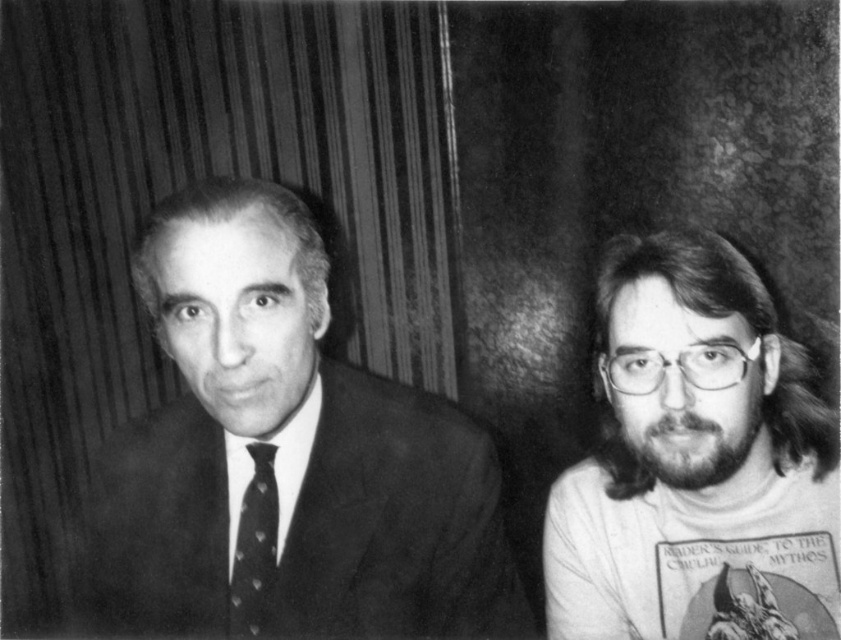
You are standing in front of a black and white photograph. There are two points marked in the image. The first point is at coordinates point [752,573] and the second is at point [262,456]. Which point is closer to you?

Point [752,573] is in front of point [262,456], so it is closer to you.

You are a photographer adjusting the focus on your camera. You want to ensure that the point at coordinates point (281, 508) is in sharp focus. Given that the camera can focus precisely at 34.53 inches, will this point be in focus?

Yes, the point (281, 508) is exactly 34.53 inches from the camera, so it will be in sharp focus.

Consider the image. You are a photographer who needs to place a 20 cm wide award plaque between the smooth black suit at left and the bearded man with glasses at right in the photo. Can the plaque fit between them without overlapping either?

The smooth black suit at left is 22.85 centimeters from bearded man with glasses at right. Since the distance is greater than the plaque width of 20 cm, the plaque can fit between them without overlapping.